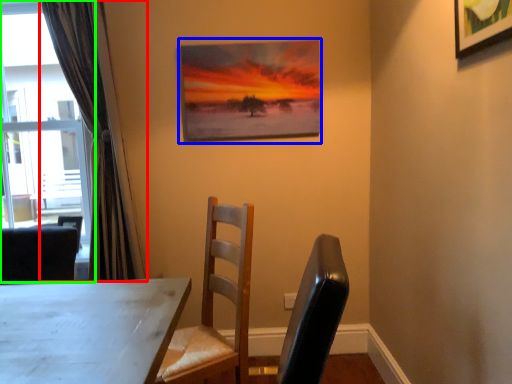
Question: Which object is positioned closest to curtain (highlighted by a red box)? Select from picture frame (highlighted by a blue box) and window (highlighted by a green box).

Choices:
 (A) picture frame
 (B) window

Answer: (A)